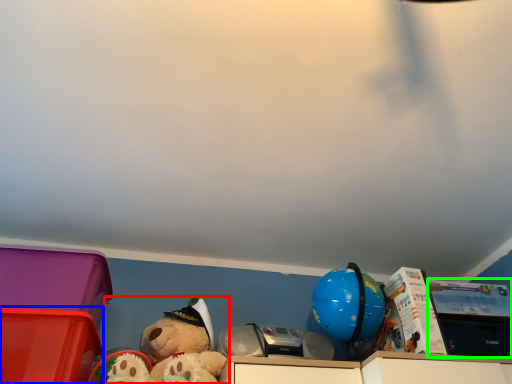
Question: Considering the real-world distances, which object is farthest from teddy bear (highlighted by a red box)? storage box (highlighted by a blue box) or storage box (highlighted by a green box)?

Choices:
 (A) storage box
 (B) storage box

Answer: (B)